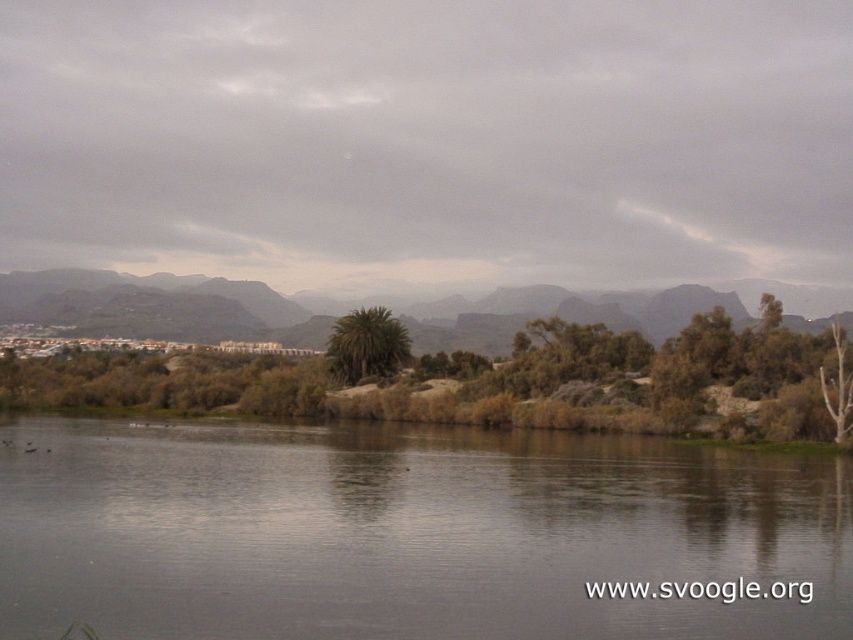
You are standing on the riverside path and notice the gray reflective water at center and the green leafy palm tree at center. Which object is closer to your eye level?

The green leafy palm tree at center is closer to your eye level because it is above the gray reflective water at center, which is positioned below it.

You are planning to plant a new tree in this riverside area. The new tree requires a minimum of 50 feet of space between it and any existing trees to thrive. Given the current spacing between the green leafy tree at center and the green leafy palm tree at center, can you plant the new tree between them without violating this spacing requirement?

The green leafy tree at center and the green leafy palm tree at center are 56.87 feet apart. Since the required minimum spacing is 50 feet, planting a new tree between them would still maintain the necessary distance as long as it is placed appropriately within the existing gap.

You are standing at the riverside and want to take a photo of the green leafy tree at center and the green leafy palm tree at center. Which tree is closer to the camera?

The green leafy tree at center is positioned under the green leafy palm tree at center, so the palm tree is closer to the camera.